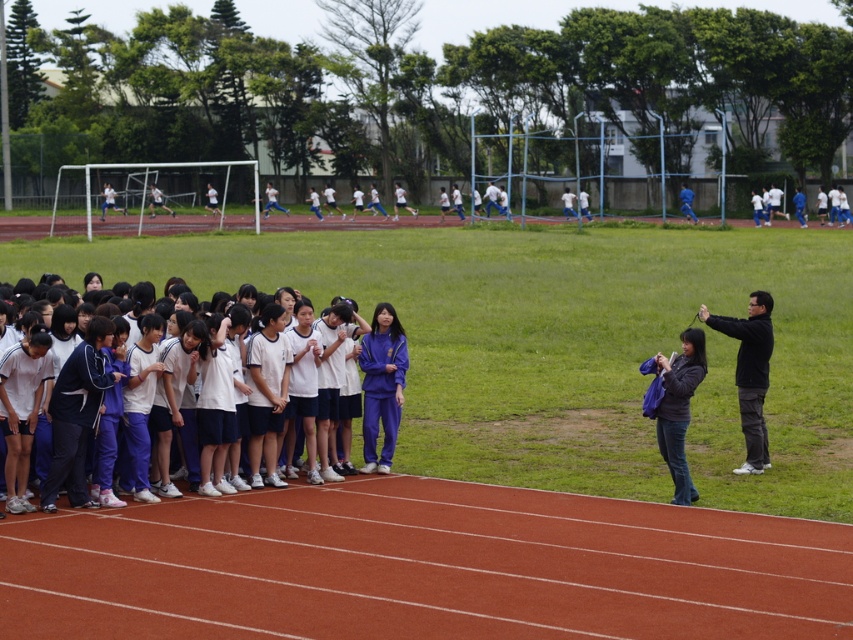
Question: Which point is farther to the camera?

Choices:
 (A) (572, 531)
 (B) (718, 328)
 (C) (694, 337)

Answer: (B)

Question: Among these objects, which one is farthest from the camera?

Choices:
 (A) white fabric uniform at center
 (B) dark gray denim jacket at lower right

Answer: (B)

Question: Observing the image, what is the correct spatial positioning of green grass football field at center in reference to black matte jacket at right?

Choices:
 (A) right
 (B) left

Answer: (B)

Question: Does green grass football field at center appear on the left side of dark gray denim jacket at lower right?

Choices:
 (A) yes
 (B) no

Answer: (A)

Question: Is green grass football field at center behind smooth red track at lower center?

Choices:
 (A) yes
 (B) no

Answer: (B)

Question: Which point is closer to the camera?

Choices:
 (A) (131, 602)
 (B) (686, 419)
 (C) (268, 380)
 (D) (762, 452)

Answer: (A)